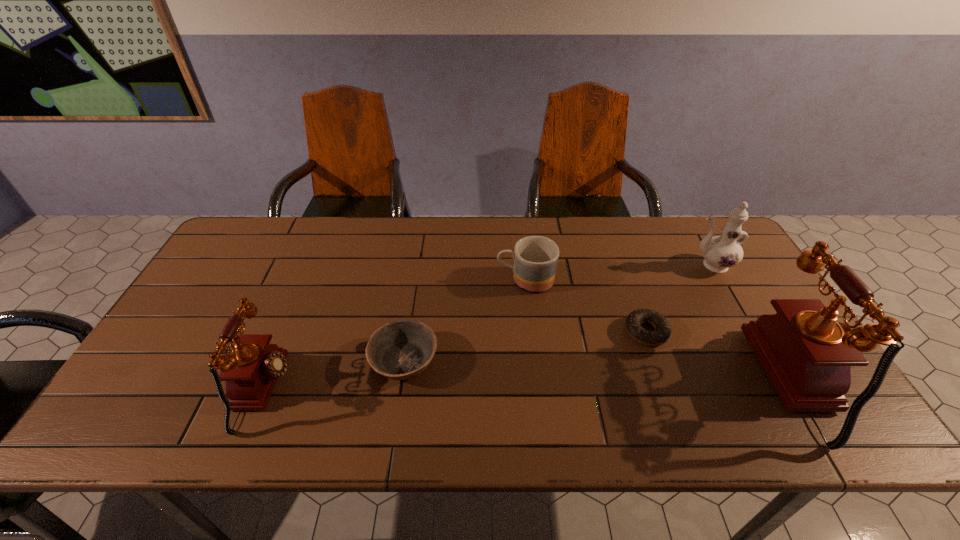
Where is `the shorter telephone`? The image size is (960, 540). the shorter telephone is located at coordinates (251, 370).

The image size is (960, 540). Find the location of `the leftmost object`. the leftmost object is located at coordinates (251, 370).

This screenshot has height=540, width=960. I want to click on the tallest object, so click(807, 355).

Identify the location of the right telephone. The height and width of the screenshot is (540, 960). (807, 355).

Where is `chinaware`? chinaware is located at coordinates (720, 252).

At what (x,y) coordinates should I click in order to perform the action: click on the shortest object. Please return your answer as a coordinate pair (x, y). The height and width of the screenshot is (540, 960). Looking at the image, I should click on 633,322.

This screenshot has width=960, height=540. Identify the location of the third object from right to left. (633, 322).

Find the location of a particular element. The width and height of the screenshot is (960, 540). mug is located at coordinates (535, 258).

This screenshot has height=540, width=960. Find the location of `the fourth tallest object`. the fourth tallest object is located at coordinates (535, 258).

You are a GUI agent. You are given a task and a screenshot of the screen. Output one action in this format:
    pyautogui.click(x=<x>, y=<y>)
    Task: Click on the fifth object from right to left
    
    Given the screenshot: What is the action you would take?
    pyautogui.click(x=399, y=350)